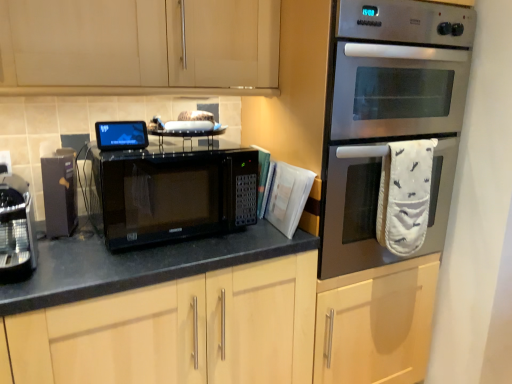
Question: Does matte black coffee machine at left, the 2th appliance positioned from the right, lie in front of stainless steel oven at right?

Choices:
 (A) no
 (B) yes

Answer: (A)

Question: Would you say matte black coffee machine at left, the 2th appliance positioned from the right, contains stainless steel oven at right?

Choices:
 (A) yes
 (B) no

Answer: (B)

Question: From a real-world perspective, is matte black coffee machine at left, the second appliance viewed from the left, physically below stainless steel oven at right?

Choices:
 (A) yes
 (B) no

Answer: (A)

Question: Is matte black coffee machine at left, the 2th appliance positioned from the right, to the left of stainless steel oven at right from the viewer's perspective?

Choices:
 (A) no
 (B) yes

Answer: (B)

Question: Is matte black coffee machine at left, the 2th appliance positioned from the right, positioned behind stainless steel oven at right?

Choices:
 (A) no
 (B) yes

Answer: (B)

Question: Based on their positions, is sleek metallic coffee machine at left, the 3th appliance in the right-to-left sequence, located to the left or right of matte black coffee machine at left, the second appliance viewed from the left?

Choices:
 (A) right
 (B) left

Answer: (B)

Question: In terms of height, does sleek metallic coffee machine at left, the 3th appliance in the right-to-left sequence, look taller or shorter compared to matte black coffee machine at left, the second appliance viewed from the left?

Choices:
 (A) tall
 (B) short

Answer: (B)

Question: Looking at their shapes, would you say sleek metallic coffee machine at left, the 3th appliance in the right-to-left sequence, is wider or thinner than matte black coffee machine at left, the 2th appliance positioned from the right?

Choices:
 (A) thin
 (B) wide

Answer: (B)

Question: Is point (26, 236) closer or farther from the camera than point (46, 187)?

Choices:
 (A) closer
 (B) farther

Answer: (A)

Question: In the image, is matte black coffee machine at left, the second appliance viewed from the left, on the left side or the right side of matte black microwave at center, marked as the 1th appliance in a right-to-left arrangement?

Choices:
 (A) right
 (B) left

Answer: (B)

Question: Looking at the image, does matte black coffee machine at left, the 2th appliance positioned from the right, seem bigger or smaller compared to matte black microwave at center, acting as the 3th appliance starting from the left?

Choices:
 (A) big
 (B) small

Answer: (A)

Question: In terms of width, does matte black coffee machine at left, the second appliance viewed from the left, look wider or thinner when compared to matte black microwave at center, acting as the 3th appliance starting from the left?

Choices:
 (A) thin
 (B) wide

Answer: (B)

Question: Considering the positions of matte black coffee machine at left, the 2th appliance positioned from the right, and matte black microwave at center, acting as the 3th appliance starting from the left, in the image, is matte black coffee machine at left, the 2th appliance positioned from the right, taller or shorter than matte black microwave at center, acting as the 3th appliance starting from the left,?

Choices:
 (A) short
 (B) tall

Answer: (B)

Question: From a real-world perspective, is matte black coffee machine at left, the 2th appliance positioned from the right, above or below black matte microwave at center?

Choices:
 (A) below
 (B) above

Answer: (B)

Question: From the image's perspective, is matte black coffee machine at left, the 2th appliance positioned from the right, located above or below black matte microwave at center?

Choices:
 (A) below
 (B) above

Answer: (B)